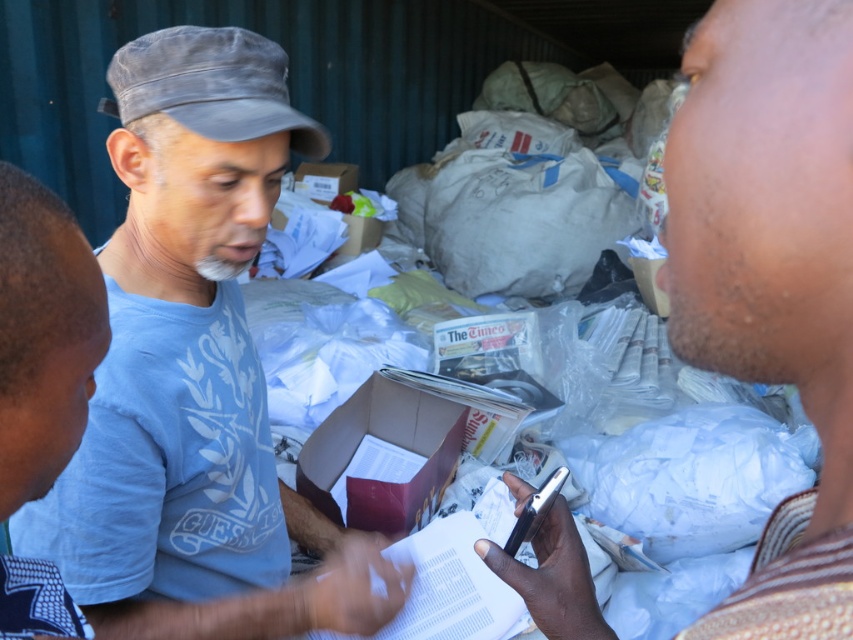
Does light blue cotton shirt at center come behind gray fabric baseball cap at upper left?

That is False.

Does light blue cotton shirt at center appear on the left side of gray fabric baseball cap at upper left?

No, light blue cotton shirt at center is not to the left of gray fabric baseball cap at upper left.

Measure the distance between point (x=367, y=595) and camera.

Point (x=367, y=595) is 34.44 inches from camera.

Identify the location of light blue cotton shirt at center. This screenshot has width=853, height=640. (195, 372).

Does smooth skin face at right have a lesser width compared to cardboard box at center?

Correct, smooth skin face at right's width is less than cardboard box at center's.

Who is more forward, (682, 116) or (357, 518)?

Point (682, 116) is in front.

Where is `smooth skin face at right`? The image size is (853, 640). smooth skin face at right is located at coordinates (770, 273).

In the scene shown: Can you confirm if gray fabric baseball cap at upper left is shorter than cardboard box at center?

Yes, gray fabric baseball cap at upper left is shorter than cardboard box at center.

Can you confirm if gray fabric baseball cap at upper left is positioned to the left of cardboard box at center?

Indeed, gray fabric baseball cap at upper left is positioned on the left side of cardboard box at center.

Which is in front, point (196, 70) or point (335, 480)?

Point (196, 70)

Locate an element on the screen. This screenshot has width=853, height=640. gray fabric baseball cap at upper left is located at coordinates (210, 84).